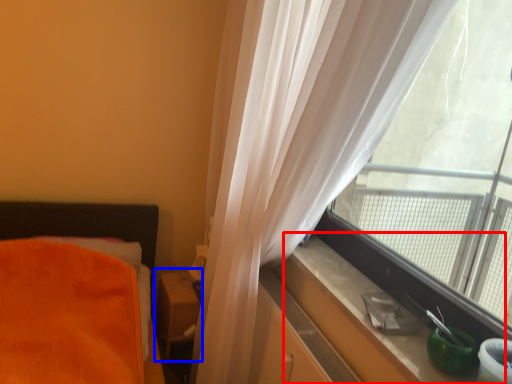
Question: Which of the following is the farthest to the observer, window sill (highlighted by a red box) or table (highlighted by a blue box)?

Choices:
 (A) window sill
 (B) table

Answer: (B)